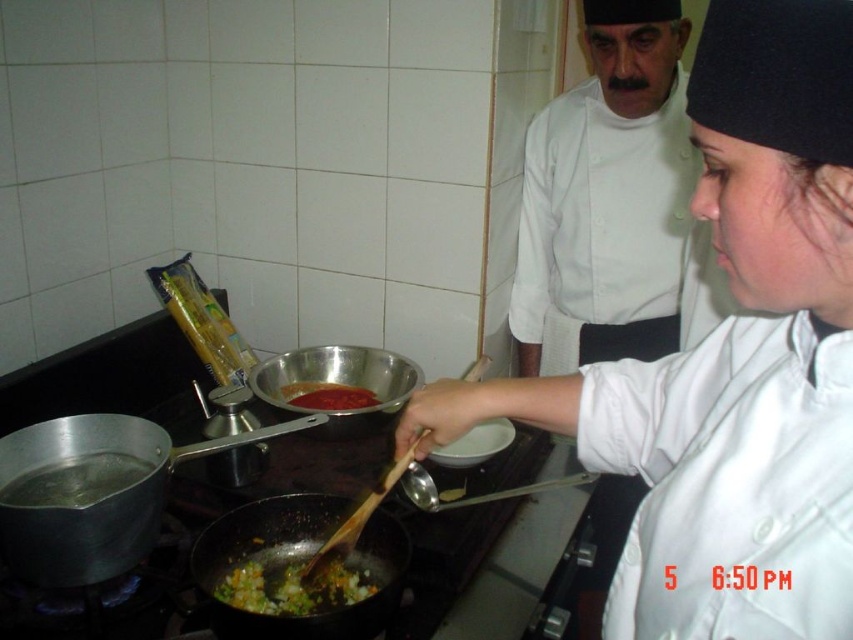
Question: Among these points, which one is nearest to the camera?

Choices:
 (A) (410, 493)
 (B) (397, 362)
 (C) (235, 605)

Answer: (C)

Question: Is black non-stick wok at center further to camera compared to chopped vegetables at center?

Choices:
 (A) yes
 (B) no

Answer: (B)

Question: Which object is farther from the camera taking this photo?

Choices:
 (A) shiny black wok at center
 (B) chopped vegetables at center

Answer: (A)

Question: In this image, where is shiny black wok at lower center located relative to shiny black wok at center?

Choices:
 (A) right
 (B) left

Answer: (B)

Question: From the image, what is the correct spatial relationship of metallic silver wok at center in relation to shiny black wok at center?

Choices:
 (A) above
 (B) below

Answer: (A)

Question: Which of these objects is positioned farthest from the metallic silver wok at center?

Choices:
 (A) chopped vegetables at center
 (B) tomato sauce at center

Answer: (A)